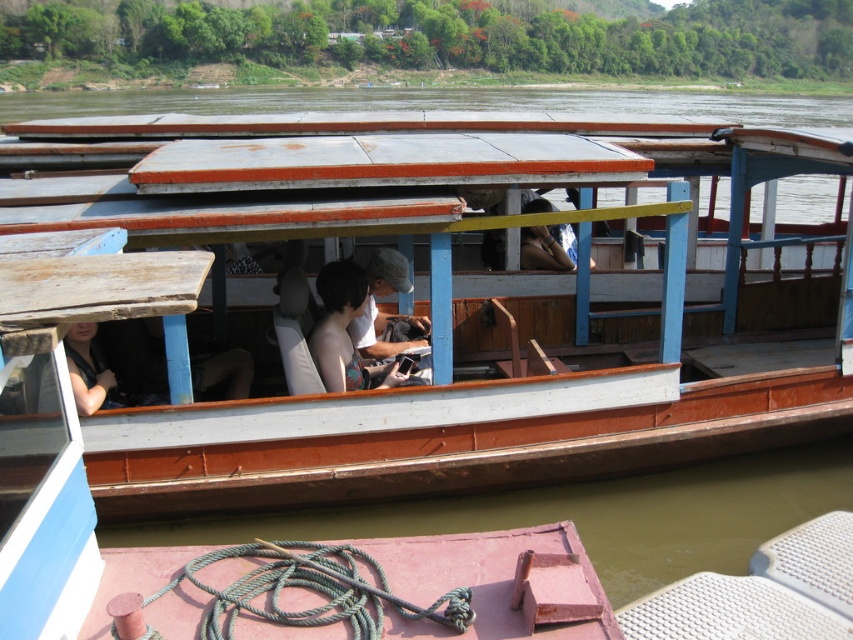
Can you confirm if wooden boat at center is wider than matte gray cap at center?

Yes, wooden boat at center is wider than matte gray cap at center.

Is wooden boat at center positioned at the back of matte gray cap at center?

Yes, wooden boat at center is behind matte gray cap at center.

Between point (730, 333) and point (372, 289), which one is positioned behind?

The point (730, 333) is behind.

You are a GUI agent. You are given a task and a screenshot of the screen. Output one action in this format:
    pyautogui.click(x=<x>, y=<y>)
    Task: Click on the wooden boat at center
    The image size is (853, 640).
    Given the screenshot: What is the action you would take?
    tap(473, 312)

Does matte gray cap at center have a larger size compared to matte black shirt at center?

Yes, matte gray cap at center is bigger than matte black shirt at center.

Can you confirm if matte gray cap at center is smaller than matte black shirt at center?

Actually, matte gray cap at center might be larger than matte black shirt at center.

Identify the location of matte gray cap at center. (384, 312).

Is wooden boat at center positioned at the back of skinny white shirt at center?

Yes, wooden boat at center is further from the viewer.

Is wooden boat at center below skinny white shirt at center?

Actually, wooden boat at center is above skinny white shirt at center.

Is point (387, 493) positioned behind point (326, 372)?

Yes, point (387, 493) is farther from viewer.

Locate an element on the screen. Image resolution: width=853 pixels, height=640 pixels. wooden boat at center is located at coordinates (473, 312).